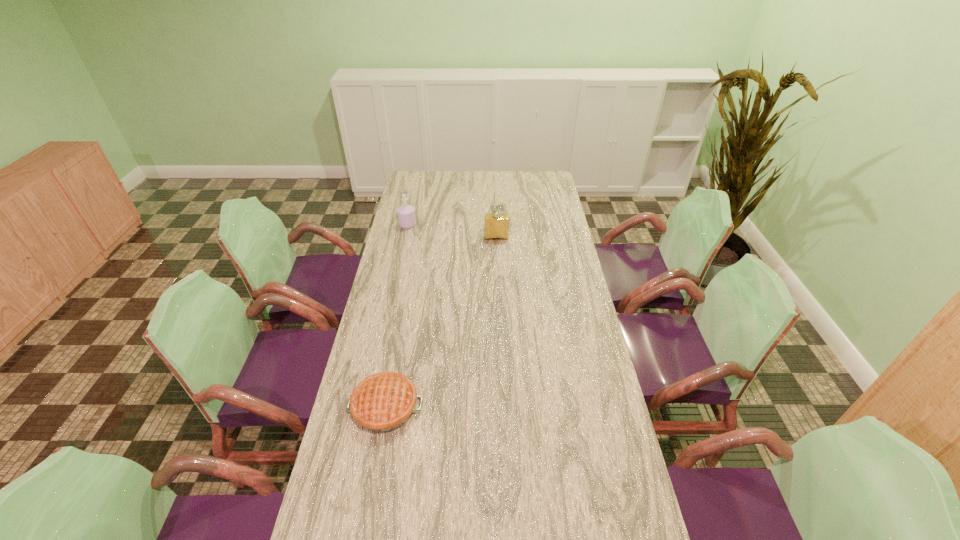
Find the location of a particular element. The image size is (960, 540). pie situated at the left edge is located at coordinates (382, 402).

Identify the location of free point at the far edge. (464, 177).

In the image, there is a desktop. Find the location of `vacant space at the left edge`. vacant space at the left edge is located at coordinates (418, 232).

This screenshot has height=540, width=960. I want to click on vacant space at the right edge of the desktop, so click(539, 220).

You are a GUI agent. You are given a task and a screenshot of the screen. Output one action in this format:
    pyautogui.click(x=<x>, y=<y>)
    Task: Click on the free point between the nearer perfume and the shortest object
    
    Given the screenshot: What is the action you would take?
    [x=441, y=322]

I want to click on vacant region between the pie and the farther perfume, so click(x=396, y=316).

The image size is (960, 540). Find the location of `vacant area that lies between the right perfume and the left perfume`. vacant area that lies between the right perfume and the left perfume is located at coordinates (452, 231).

At what (x,y) coordinates should I click in order to perform the action: click on free space between the pie and the farther perfume. Please return your answer as a coordinate pair (x, y). The width and height of the screenshot is (960, 540). Looking at the image, I should click on (396, 316).

The width and height of the screenshot is (960, 540). In order to click on unoccupied area between the second farthest object and the pie in this screenshot , I will do `click(441, 322)`.

At what (x,y) coordinates should I click in order to perform the action: click on object that can be found as the closest to the shortest object. Please return your answer as a coordinate pair (x, y). Image resolution: width=960 pixels, height=540 pixels. Looking at the image, I should click on (496, 225).